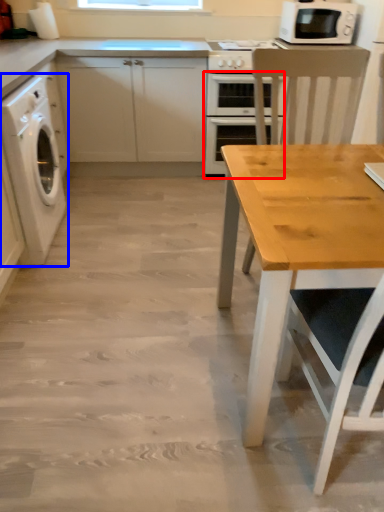
Question: Which object appears closest to the camera in this image, oven (highlighted by a red box) or washing machine (highlighted by a blue box)?

Choices:
 (A) oven
 (B) washing machine

Answer: (B)